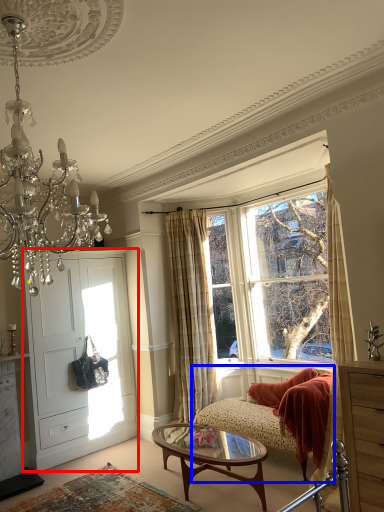
Question: Which point is further to the camera, door (highlighted by a red box) or studio couch (highlighted by a blue box)?

Choices:
 (A) door
 (B) studio couch

Answer: (A)